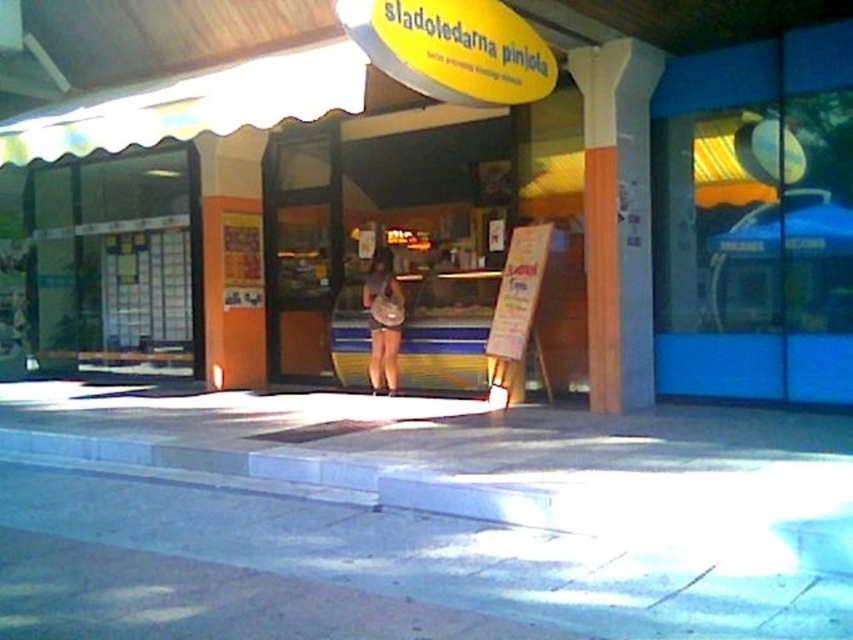
Is gray concrete pavement at center smaller than matte brown purse at center?

Yes.

Is point (403, 516) more distant than point (366, 276)?

No, it is not.

At what (x,y) coordinates should I click in order to perform the action: click on gray concrete pavement at center. Please return your answer as a coordinate pair (x, y). This screenshot has width=853, height=640. Looking at the image, I should click on (416, 518).

Does point (575, 74) come behind point (316, 129)?

No, (575, 74) is in front of (316, 129).

Which is in front, point (598, 122) or point (329, 268)?

Point (598, 122) is more forward.

Is point (596, 76) positioned behind point (283, 163)?

No, it is not.

Find the location of `wooden post at center`. wooden post at center is located at coordinates (618, 218).

Is gray concrete pavement at center further to the viewer compared to wooden sign at center?

No, it is in front of wooden sign at center.

Does gray concrete pavement at center have a larger size compared to wooden sign at center?

No, gray concrete pavement at center is not bigger than wooden sign at center.

Who is more forward, (x=71, y=582) or (x=503, y=298)?

Point (x=71, y=582)

Find the location of a particular element. The width and height of the screenshot is (853, 640). gray concrete pavement at center is located at coordinates (416, 518).